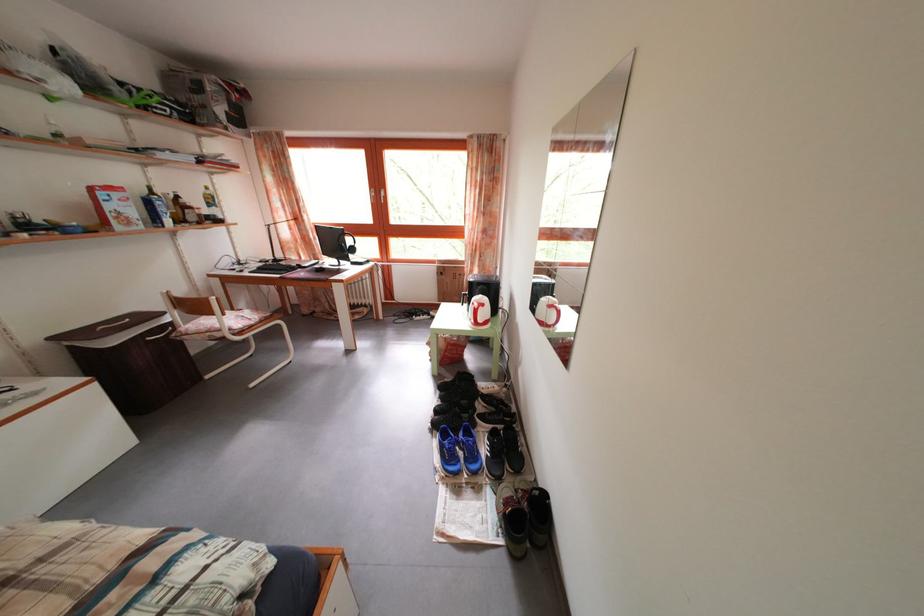
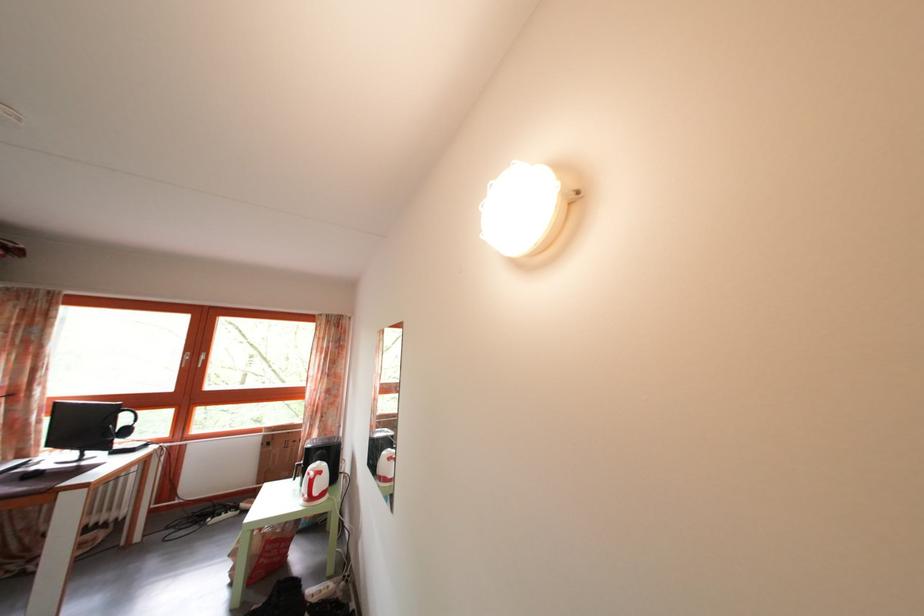
How did the camera likely rotate?

The camera rotated toward right-up.